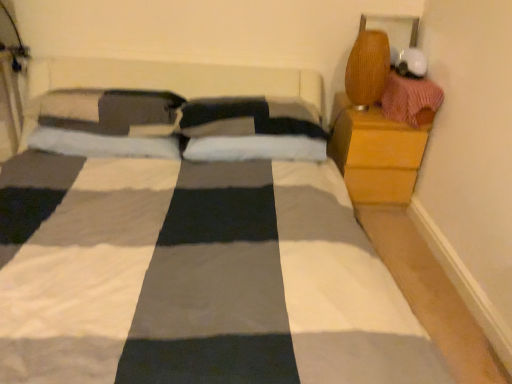
Question: Considering the positions of point (403, 162) and point (431, 86), is point (403, 162) closer or farther from the camera than point (431, 86)?

Choices:
 (A) farther
 (B) closer

Answer: (A)

Question: Would you say wooden nightstand at right is to the left or to the right of knitted pink sweater at upper right in the picture?

Choices:
 (A) right
 (B) left

Answer: (B)

Question: Do you think wooden nightstand at right is within knitted pink sweater at upper right, or outside of it?

Choices:
 (A) outside
 (B) inside

Answer: (A)

Question: Looking at their shapes, would you say knitted pink sweater at upper right is wider or thinner than wooden nightstand at right?

Choices:
 (A) wide
 (B) thin

Answer: (B)

Question: Is point (412, 102) positioned closer to the camera than point (335, 157)?

Choices:
 (A) farther
 (B) closer

Answer: (B)

Question: Relative to wooden nightstand at right, is knitted pink sweater at upper right in front or behind?

Choices:
 (A) front
 (B) behind

Answer: (A)

Question: Based on their positions, is knitted pink sweater at upper right located to the left or right of wooden nightstand at right?

Choices:
 (A) right
 (B) left

Answer: (A)